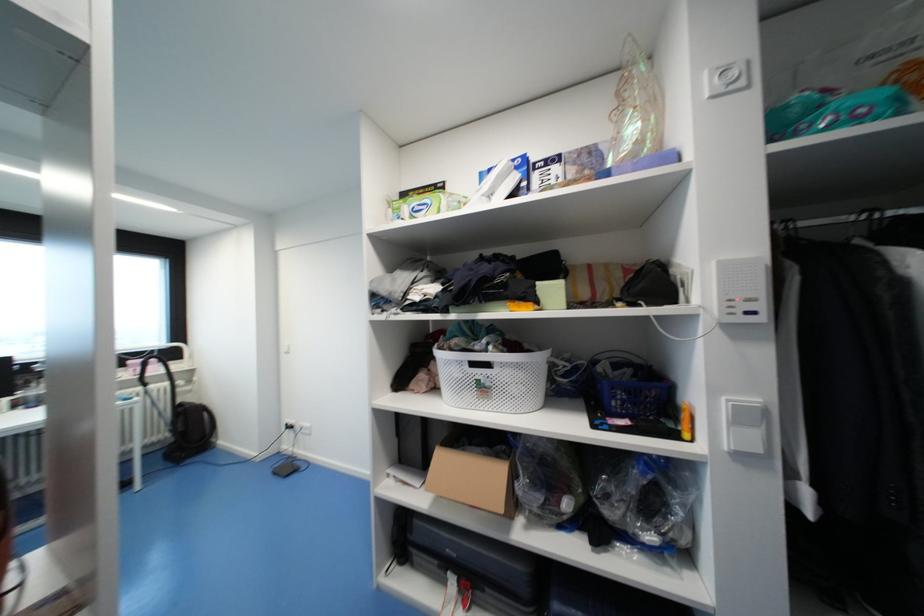
Find where to press the white light switch. Please return your answer as a coordinate pair (x, y).

(726, 79)